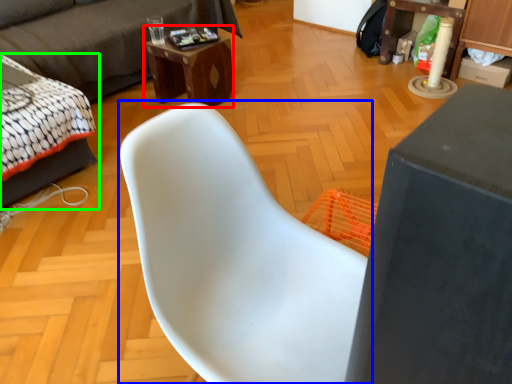
Question: Which object is the farthest from desk (highlighted by a red box)? Choose among these: chair (highlighted by a blue box) or bed (highlighted by a green box).

Choices:
 (A) chair
 (B) bed

Answer: (A)